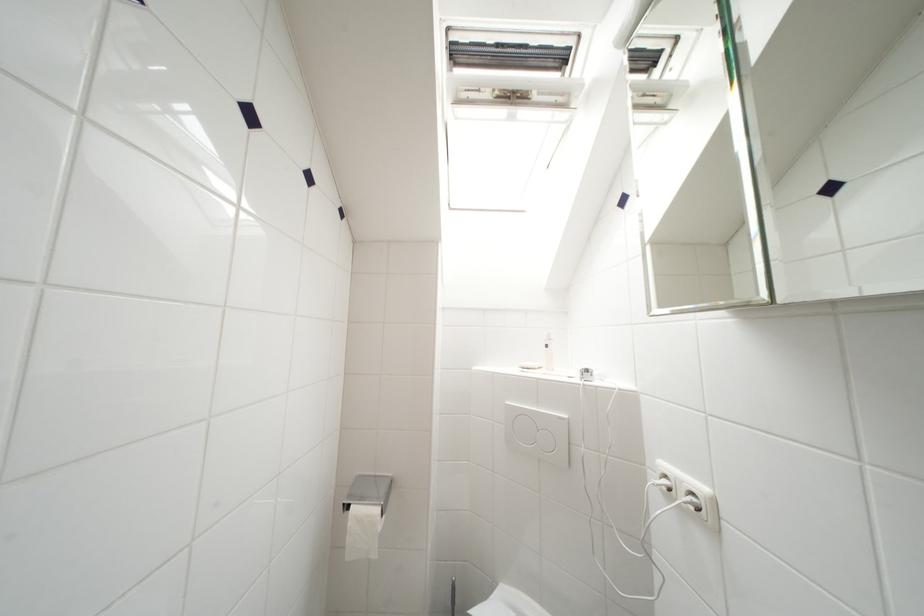
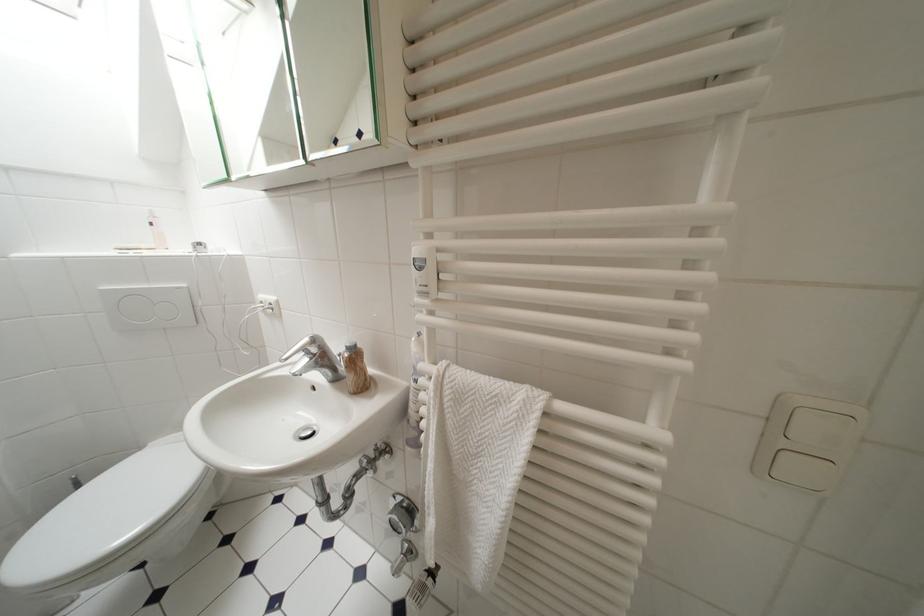
Locate, in the second image, the point that corresponds to pixel 553 350 in the first image.

(159, 227)